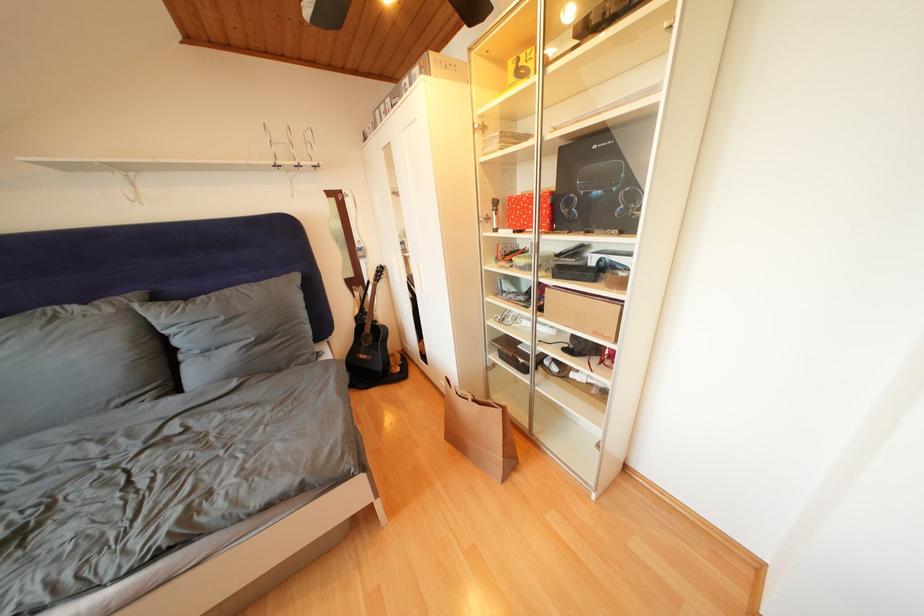
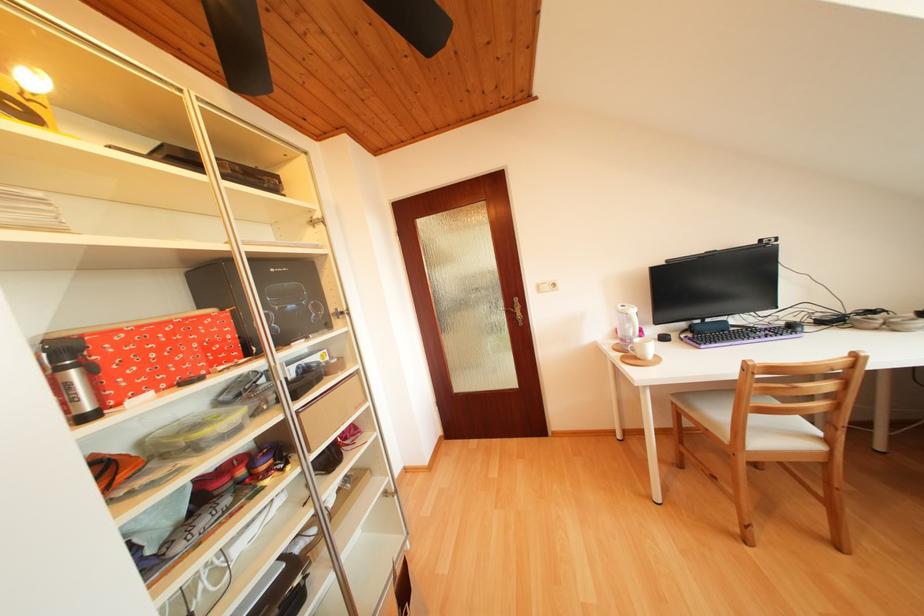
Where in the second image is the point corresponding to (x=525, y=215) from the first image?

(151, 358)